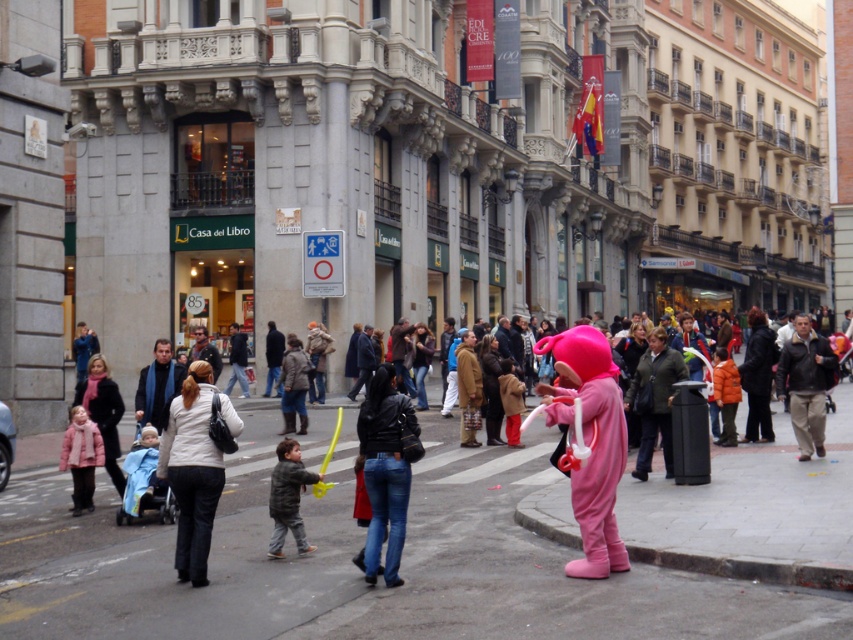
Based on the photo, you are a delivery drone flying over an urban street scene. You need to drop off a package at the pink fabric costume at center. According to the coordinates provided, where exactly should you aim to deliver the package?

The pink fabric costume at center is located at point (357, 568), so you should aim for those coordinates to deliver the package accurately.

Looking at this image, you are a tailor observing two jackets displayed at a store window. The jackets are the white matte jacket at center and the dark gray jacket at center. Which jacket has a greater width?

The white matte jacket at center has a greater width than the dark gray jacket at center according to the description.

You are a photographer standing in the middle of the street. You want to take a photo that includes both the point at coordinates point (160, 524) and point (407, 422). Which point should you focus on first to ensure both are in focus?

You should focus on point (407, 422) first because it is closer to you than point (160, 524), which is further away. By focusing on the closer point, the depth of field may also cover the farther point, ensuring both are in focus.